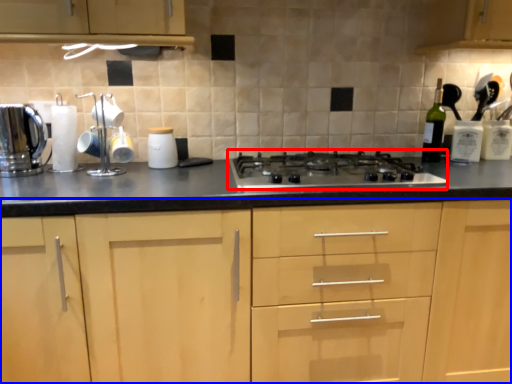
Question: Among these objects, which one is farthest to the camera, gas stove (highlighted by a red box) or cabinetry (highlighted by a blue box)?

Choices:
 (A) gas stove
 (B) cabinetry

Answer: (A)